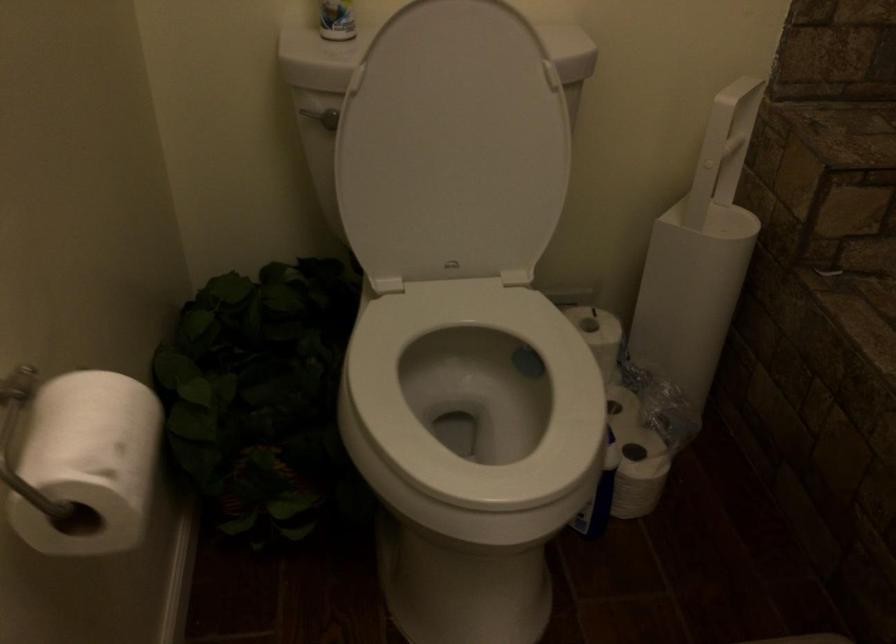
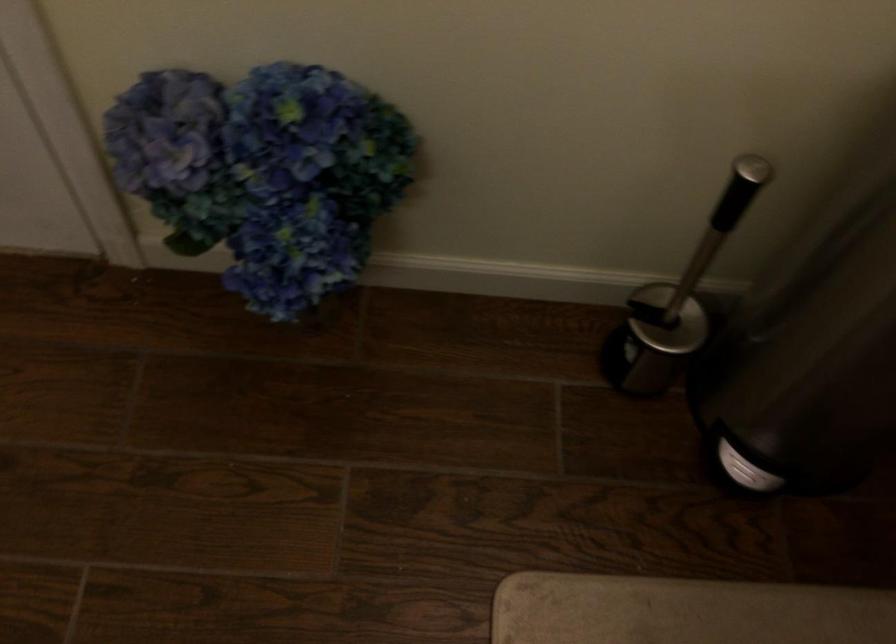
First-person continuous shooting, in which direction is the camera rotating?

The camera rotated toward left-down.